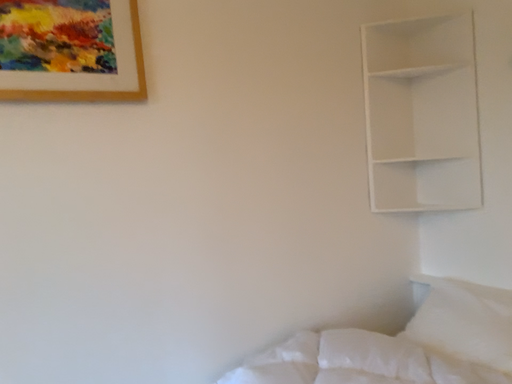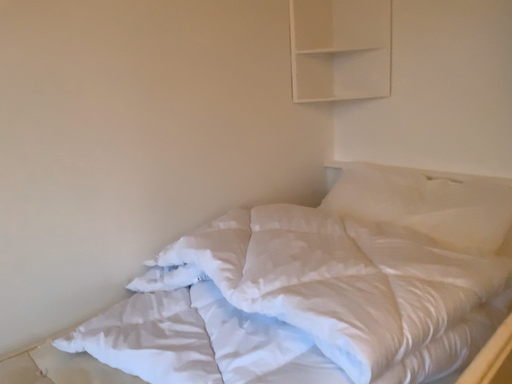
Question: How did the camera likely rotate when shooting the video?

Choices:
 (A) rotated right
 (B) rotated left

Answer: (A)